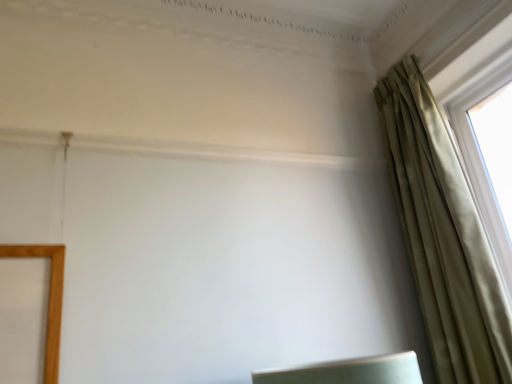
Find the location of a particular element. This screenshot has height=384, width=512. green satin curtain at upper right is located at coordinates (443, 235).

What do you see at coordinates (443, 235) in the screenshot? This screenshot has height=384, width=512. I see `green satin curtain at upper right` at bounding box center [443, 235].

Where is `green satin curtain at upper right`? This screenshot has width=512, height=384. green satin curtain at upper right is located at coordinates (443, 235).